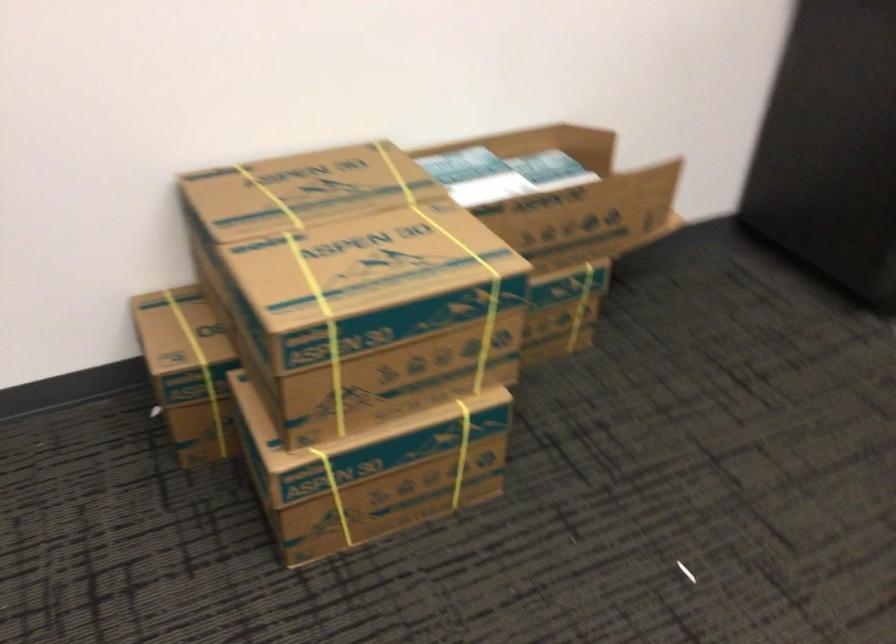
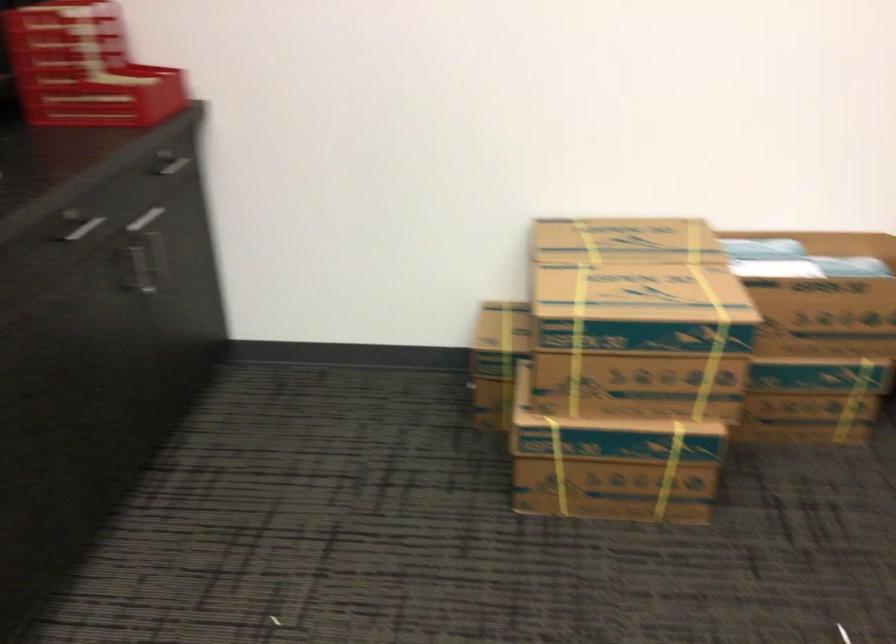
The point at (x=400, y=497) is marked in the first image. Where is the corresponding point in the second image?

(613, 489)